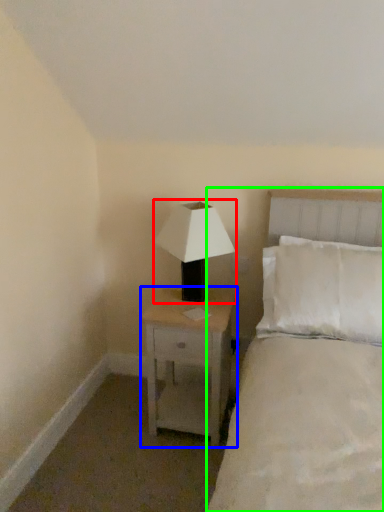
Question: Considering the real-world distances, which object is farthest from lamp (highlighted by a red box)? nightstand (highlighted by a blue box) or bed (highlighted by a green box)?

Choices:
 (A) nightstand
 (B) bed

Answer: (B)